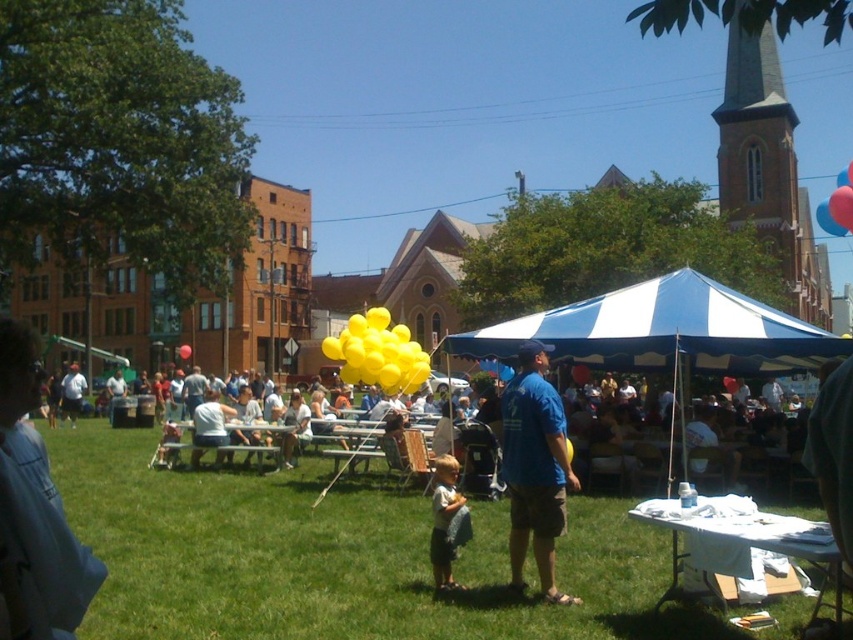
Question: Which point is farther to the camera?

Choices:
 (A) blue and white striped canopy at center
 (B) rubber balloon at upper right

Answer: (B)

Question: Which of these objects is positioned farthest from the yellow balloons at center?

Choices:
 (A) green grass at center
 (B) blue/white striped canopy at center
 (C) blue rubber balloon at upper right

Answer: (C)

Question: Considering the relative positions of yellow balloons at center and white cloth-covered picnic table at lower right in the image provided, where is yellow balloons at center located with respect to white cloth-covered picnic table at lower right?

Choices:
 (A) left
 (B) right

Answer: (A)

Question: Does yellow balloons at center appear on the left side of blue cotton shirt at center?

Choices:
 (A) no
 (B) yes

Answer: (B)

Question: Can you confirm if blue and white striped canopy at center is positioned above light brown fabric shirt at center?

Choices:
 (A) yes
 (B) no

Answer: (A)

Question: Which object is the farthest from the green grass at center?

Choices:
 (A) blue shirt at center
 (B) blue/white striped canopy at center

Answer: (A)